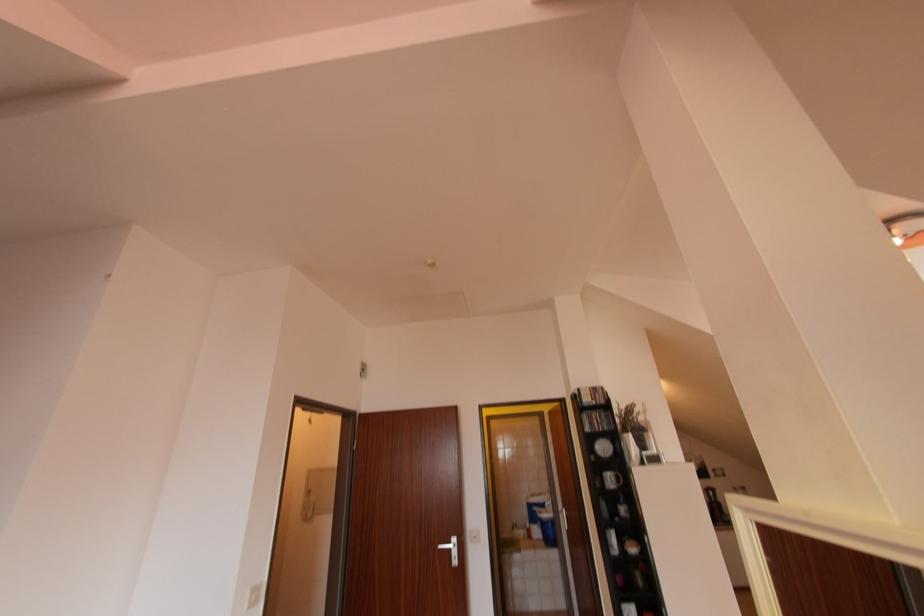
Locate an element on the screen. silver door handle is located at coordinates (450, 548).